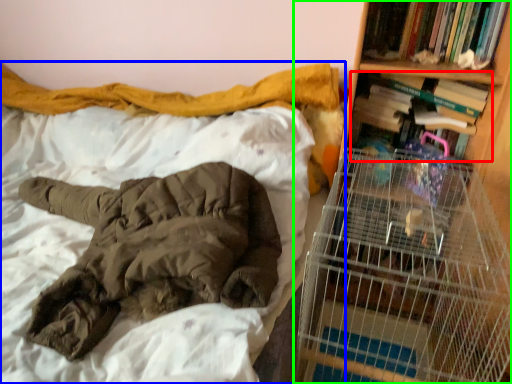
Question: Estimate the real-world distances between objects in this image. Which object is closer to book (highlighted by a red box), bed (highlighted by a blue box) or bookcase (highlighted by a green box)?

Choices:
 (A) bed
 (B) bookcase

Answer: (B)